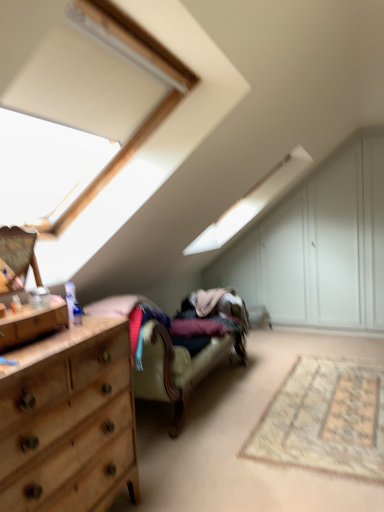
What do you see at coordinates (318, 247) in the screenshot?
I see `white wood dresser at upper right` at bounding box center [318, 247].

The width and height of the screenshot is (384, 512). I want to click on beige woven rug at lower right, so click(x=325, y=419).

What is the approximate height of wooden dresser at left?

wooden dresser at left is 95.12 centimeters tall.

What do you see at coordinates (177, 344) in the screenshot? The image size is (384, 512). I see `velvet beige couch at center` at bounding box center [177, 344].

What is the approximate height of wooden dresser at left?

wooden dresser at left is 4.95 inches tall.

The image size is (384, 512). What are the coordinates of `white wood dresser at upper right` in the screenshot? It's located at (318, 247).

From the image's perspective, is white wood dresser at upper right over velvet beige couch at center?

Yes, from the image's perspective, white wood dresser at upper right is on top of velvet beige couch at center.

Looking at their sizes, would you say white wood dresser at upper right is wider or thinner than velvet beige couch at center?

white wood dresser at upper right is thinner than velvet beige couch at center.

Where is `dresser above the velvet beige couch at center (from a real-world perspective)`? This screenshot has height=512, width=384. dresser above the velvet beige couch at center (from a real-world perspective) is located at coordinates (318, 247).

Which object is further away from the camera, beige woven rug at lower right or wooden dresser at left?

beige woven rug at lower right.

Would you say beige woven rug at lower right is inside or outside wooden dresser at left?

beige woven rug at lower right is outside wooden dresser at left.

Visually, is beige woven rug at lower right positioned to the left or to the right of wooden dresser at left?

beige woven rug at lower right is positioned on wooden dresser at left's right side.

From a real-world perspective, who is located higher, beige woven rug at lower right or velvet beige couch at center?

velvet beige couch at center.

Does beige woven rug at lower right have a smaller size compared to velvet beige couch at center?

Yes, beige woven rug at lower right is smaller than velvet beige couch at center.

Is velvet beige couch at center surrounded by beige woven rug at lower right?

No.

Based on the photo, can you confirm if beige woven rug at lower right is wider than velvet beige couch at center?

Yes.

How distant is wooden dresser at left from beige woven rug at lower right?

They are 1.88 meters apart.

Can you confirm if wooden dresser at left is bigger than beige woven rug at lower right?

Incorrect, wooden dresser at left is not larger than beige woven rug at lower right.

From the image's perspective, would you say wooden dresser at left is positioned over beige woven rug at lower right?

Correct, wooden dresser at left appears higher than beige woven rug at lower right in the image.

How different are the orientations of wooden dresser at left and beige woven rug at lower right in degrees?

There is a 92.5-degree angle between the facing directions of wooden dresser at left and beige woven rug at lower right.

Locate an element on the screen. This screenshot has width=384, height=512. studio couch on the right side of wooden dresser at left is located at coordinates (177, 344).

Does wooden dresser at left have a lesser width compared to velvet beige couch at center?

Yes.

From a real-world perspective, between wooden dresser at left and velvet beige couch at center, who is vertically lower?

velvet beige couch at center is physically lower.

Considering the positions of points (7, 254) and (326, 179), is point (7, 254) closer to camera compared to point (326, 179)?

That is True.

Which object is positioned more to the right, wooden dresser at left or white wood dresser at upper right?

white wood dresser at upper right is more to the right.

Where is `cabinetry below the white wood dresser at upper right (from the image's perspective)`? The image size is (384, 512). cabinetry below the white wood dresser at upper right (from the image's perspective) is located at coordinates click(16, 259).

Would you say wooden dresser at left is inside or outside white wood dresser at upper right?

The correct answer is: outside.

Is the position of beige woven rug at lower right more distant than that of white wood dresser at upper right?

No, it is in front of white wood dresser at upper right.

Is beige woven rug at lower right taller than white wood dresser at upper right?

Incorrect, the height of beige woven rug at lower right is not larger of that of white wood dresser at upper right.

Can you confirm if beige woven rug at lower right is positioned to the right of white wood dresser at upper right?

Incorrect, beige woven rug at lower right is not on the right side of white wood dresser at upper right.

Where is `dresser lying behind the velvet beige couch at center`? The width and height of the screenshot is (384, 512). dresser lying behind the velvet beige couch at center is located at coordinates (318, 247).

Find the location of a particular element. chest of drawers on the left of beige woven rug at lower right is located at coordinates (68, 421).

Considering their positions, is wooden dresser at left positioned further to wooden dresser at left than white wood dresser at upper right?

The object further to wooden dresser at left is white wood dresser at upper right.

Estimate the real-world distances between objects in this image. Which object is further from wooden dresser at left, velvet beige couch at center or white wood dresser at upper right?

Among the two, white wood dresser at upper right is located further to wooden dresser at left.

Considering their positions, is white wood dresser at upper right positioned closer to beige woven rug at lower right than velvet beige couch at center?

Among the two, velvet beige couch at center is located nearer to beige woven rug at lower right.

Looking at the image, which one is located further to beige woven rug at lower right, white wood dresser at upper right or wooden dresser at left?

Among the two, white wood dresser at upper right is located further to beige woven rug at lower right.

Considering their positions, is wooden dresser at left positioned closer to beige woven rug at lower right than velvet beige couch at center?

Based on the image, velvet beige couch at center appears to be nearer to beige woven rug at lower right.

Looking at the image, which one is located further to beige woven rug at lower right, wooden dresser at left or wooden dresser at left?

wooden dresser at left is positioned further to the anchor beige woven rug at lower right.

Based on their spatial positions, is wooden dresser at left or wooden dresser at left closer to beige woven rug at lower right?

The object closer to beige woven rug at lower right is wooden dresser at left.

Estimate the real-world distances between objects in this image. Which object is closer to velvet beige couch at center, white wood dresser at upper right or wooden dresser at left?

wooden dresser at left lies closer to velvet beige couch at center than the other object.

At what (x,y) coordinates should I click in order to perform the action: click on mat between wooden dresser at left and white wood dresser at upper right from front to back. Please return your answer as a coordinate pair (x, y). The height and width of the screenshot is (512, 384). Looking at the image, I should click on (325, 419).

This screenshot has width=384, height=512. What are the coordinates of `studio couch located between wooden dresser at left and beige woven rug at lower right in the left-right direction` in the screenshot? It's located at (177, 344).

Find the location of a particular element. cabinetry between wooden dresser at left and velvet beige couch at center along the z-axis is located at coordinates (16, 259).

The image size is (384, 512). I want to click on drawer positioned between wooden dresser at left and white wood dresser at upper right from near to far, so click(32, 322).